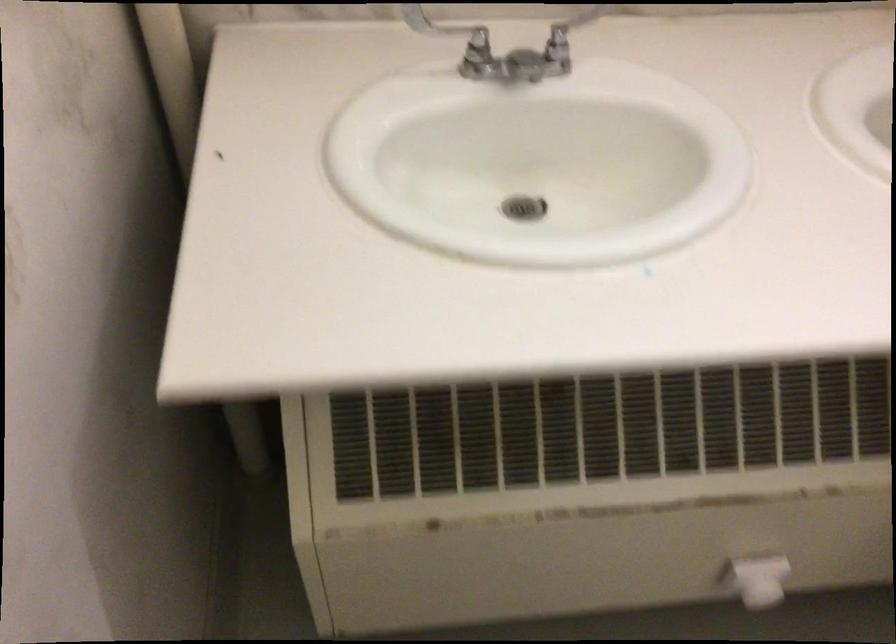
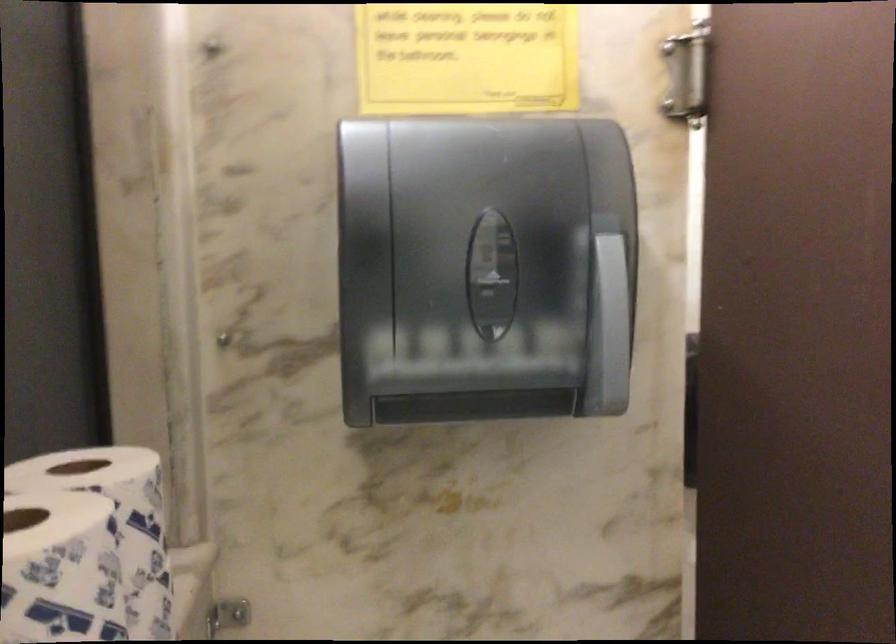
Question: The images are taken continuously from a first-person perspective. In which direction is your viewpoint rotating?

Choices:
 (A) Left
 (B) Right
 (C) Up
 (D) Down

Answer: (B)